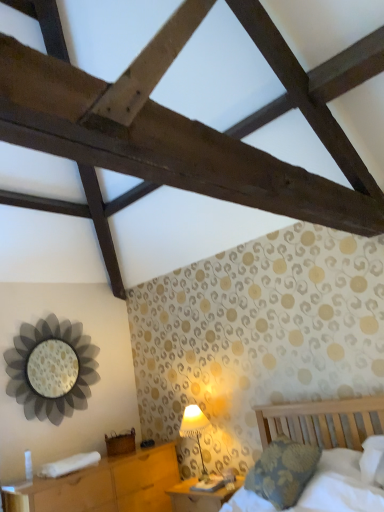
Question: From a real-world perspective, is wooden nightstand at lower left, which appears as the first nightstand when viewed from the left, physically above wooden nightstand at lower center, which ranks as the 1th nightstand in right-to-left order?

Choices:
 (A) no
 (B) yes

Answer: (B)

Question: From the image's perspective, is wooden nightstand at lower left, which appears as the first nightstand when viewed from the left, located above wooden nightstand at lower center, positioned as the 2th nightstand in left-to-right order?

Choices:
 (A) no
 (B) yes

Answer: (A)

Question: Considering the relative sizes of wooden nightstand at lower left, which appears as the first nightstand when viewed from the left, and wooden nightstand at lower center, which ranks as the 1th nightstand in right-to-left order, in the image provided, is wooden nightstand at lower left, which appears as the first nightstand when viewed from the left, taller than wooden nightstand at lower center, which ranks as the 1th nightstand in right-to-left order,?

Choices:
 (A) yes
 (B) no

Answer: (A)

Question: Considering the relative sizes of wooden nightstand at lower left, the 2th nightstand when ordered from right to left, and wooden nightstand at lower center, which ranks as the 1th nightstand in right-to-left order, in the image provided, is wooden nightstand at lower left, the 2th nightstand when ordered from right to left, shorter than wooden nightstand at lower center, which ranks as the 1th nightstand in right-to-left order,?

Choices:
 (A) yes
 (B) no

Answer: (B)

Question: Is the depth of wooden nightstand at lower left, the 2th nightstand when ordered from right to left, greater than that of wooden nightstand at lower center, which ranks as the 1th nightstand in right-to-left order?

Choices:
 (A) yes
 (B) no

Answer: (B)

Question: From a real-world perspective, is wooden nightstand at lower left, which appears as the first nightstand when viewed from the left, physically located above or below metallic flower-shaped mirror at left?

Choices:
 (A) above
 (B) below

Answer: (B)

Question: Is wooden nightstand at lower left, the 2th nightstand when ordered from right to left, to the left or to the right of metallic flower-shaped mirror at left in the image?

Choices:
 (A) left
 (B) right

Answer: (B)

Question: In the image, is wooden nightstand at lower left, which appears as the first nightstand when viewed from the left, positioned in front of or behind metallic flower-shaped mirror at left?

Choices:
 (A) front
 (B) behind

Answer: (A)

Question: Considering the positions of wooden nightstand at lower left, the 2th nightstand when ordered from right to left, and metallic flower-shaped mirror at left in the image, is wooden nightstand at lower left, the 2th nightstand when ordered from right to left, wider or thinner than metallic flower-shaped mirror at left?

Choices:
 (A) thin
 (B) wide

Answer: (B)

Question: Is point (185, 425) positioned closer to the camera than point (367, 488)?

Choices:
 (A) closer
 (B) farther

Answer: (B)

Question: From a real-world perspective, is white fabric lampshade at lower center physically located above or below wooden bed at lower right?

Choices:
 (A) below
 (B) above

Answer: (B)

Question: Based on their positions, is white fabric lampshade at lower center located to the left or right of wooden bed at lower right?

Choices:
 (A) left
 (B) right

Answer: (A)

Question: Looking at their shapes, would you say white fabric lampshade at lower center is wider or thinner than wooden bed at lower right?

Choices:
 (A) wide
 (B) thin

Answer: (B)

Question: Is point (301, 429) closer or farther from the camera than point (226, 497)?

Choices:
 (A) farther
 (B) closer

Answer: (A)

Question: Would you say wooden bed at lower right is to the left or to the right of wooden nightstand at lower center, positioned as the 2th nightstand in left-to-right order, in the picture?

Choices:
 (A) right
 (B) left

Answer: (A)